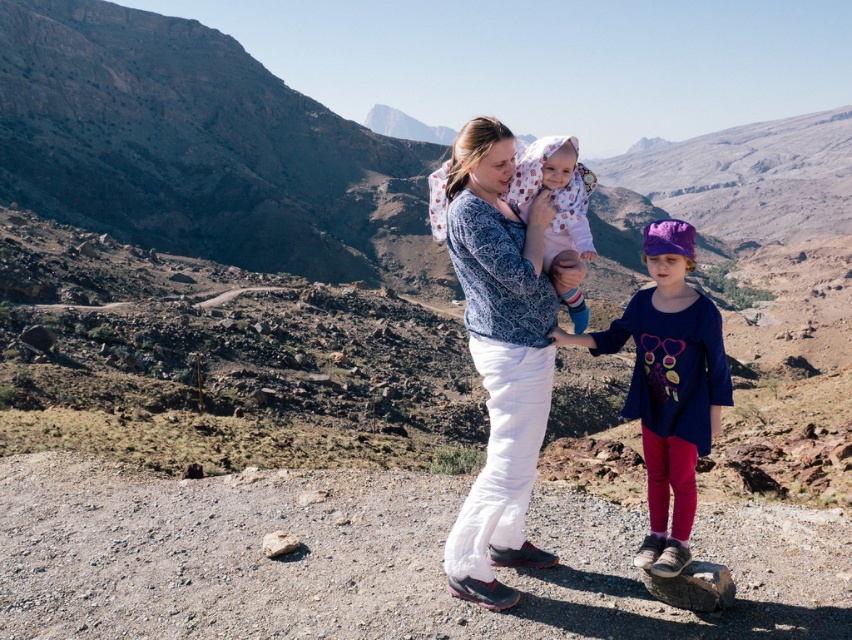
You are a photographer trying to capture a photo of the baby and the young girl in the scene. The baby is at point (481, 124) and the young girl is at point (528, 164). If you want to focus on the baby first, which point should you adjust your camera to focus on?

You should focus on point (481, 124) because it is closer to the camera than point (528, 164), ensuring the baby is in clear focus.

You are a photographer trying to capture a photo of the blue cotton shirt at center. You have a camera with a zoom lens that can focus on objects within a 0.5 unit radius. Given your current position at point (668, 385), can you capture the blue cotton shirt at center without moving?

Yes, the point (668, 385) indicates the blue cotton shirt at center, so you are already within the 0.5 unit radius required to capture it without moving.